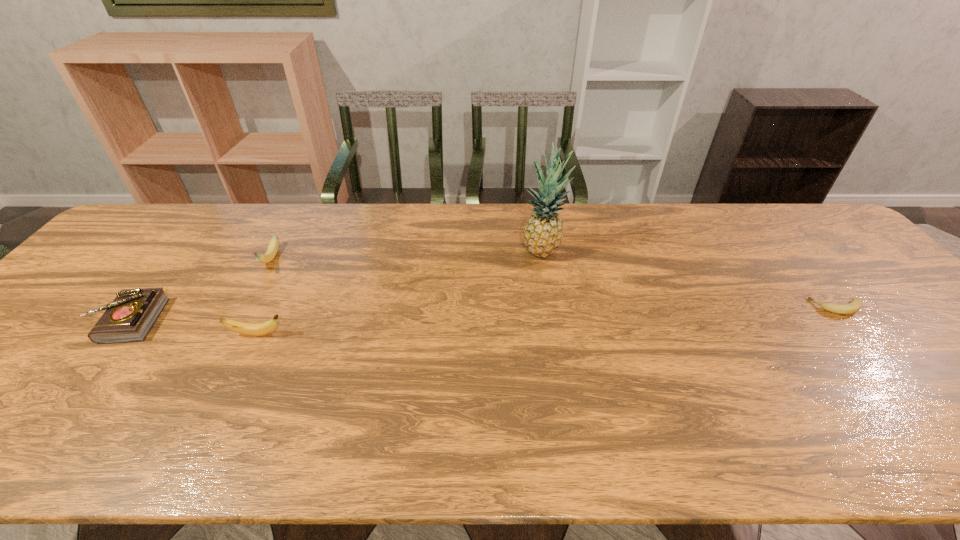
Identify the location of free spot between the tallest object and the farthest banana. (407, 255).

Locate an element on the screen. This screenshot has height=540, width=960. empty location between the diary and the tallest object is located at coordinates (336, 286).

Locate an element on the screen. vacant area between the rightmost object and the leftmost object is located at coordinates (483, 314).

Where is `free spot between the fourth tallest object and the rightmost object`? Image resolution: width=960 pixels, height=540 pixels. free spot between the fourth tallest object and the rightmost object is located at coordinates coord(483,314).

Locate an element on the screen. The width and height of the screenshot is (960, 540). the second closest object to the shortest banana is located at coordinates (259, 329).

Choose which object is the fourth nearest neighbor to the nearest banana. Please provide its 2D coordinates. Your answer should be formatted as a tuple, i.e. [(x, y)], where the tuple contains the x and y coordinates of a point satisfying the conditions above.

[(855, 305)]

Point out which banana is positioned as the second nearest to the nearest banana. Please provide its 2D coordinates. Your answer should be formatted as a tuple, i.e. [(x, y)], where the tuple contains the x and y coordinates of a point satisfying the conditions above.

[(855, 305)]

Identify which banana is the third nearest to the diary. Please provide its 2D coordinates. Your answer should be formatted as a tuple, i.e. [(x, y)], where the tuple contains the x and y coordinates of a point satisfying the conditions above.

[(855, 305)]

Locate an element on the screen. The height and width of the screenshot is (540, 960). vacant point that satisfies the following two spatial constraints: 1. at the stem of the rightmost banana; 2. on the front side of the leftmost object is located at coordinates [x=848, y=321].